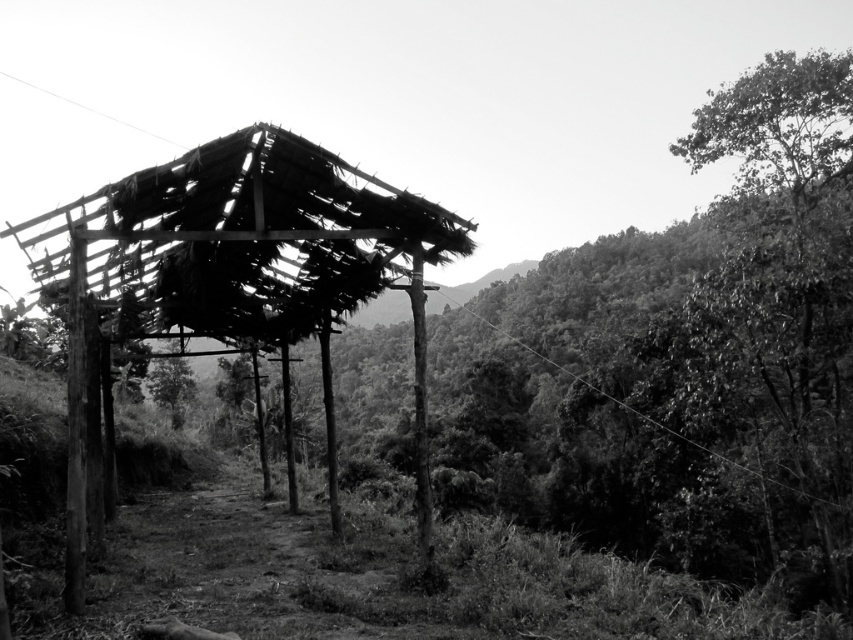
You are standing in a forest and want to take a photo of the wooden hut at center. If your camera has a maximum zoom range of 20 feet, will you need to move closer to capture the entire structure in one shot?

The wooden hut at center is 24.37 feet away from the viewer. Since the camera can only zoom up to 20 feet, you will need to move closer to ensure the entire structure fits in the photo.

You are standing at the point labeled point (224, 264) in the image. Based on the scene description, what structure are you currently located on?

The point (224, 264) is on the wooden hut at center, so you are standing on the wooden hut at center.

You are an architect designing a new eco lodge and are analyzing this shelter for inspiration. You notice the wooden pole at center and the dark green leafy tree at center. Which object has a smaller width?

The wooden pole at center has a lesser width compared to the dark green leafy tree at center.